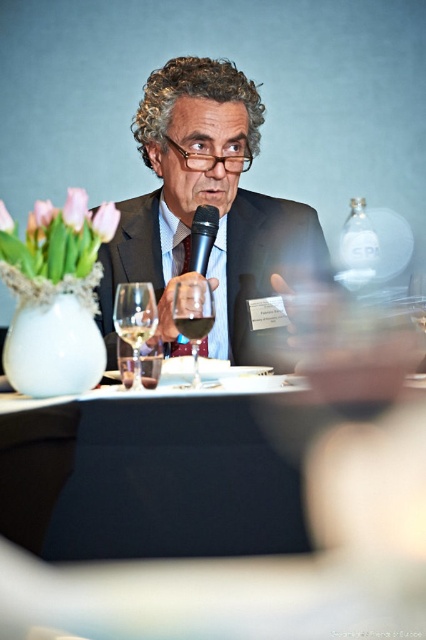
Question: Which object is positioned closest to the transparent glass wine glass at center?

Choices:
 (A) clear glass wine at center
 (B) translucent glass wine at center
 (C) black matte microphone at center
 (D) matte black suit at center

Answer: (B)

Question: Which object appears farthest from the camera in this image?

Choices:
 (A) translucent glass wine at center
 (B) black matte microphone at center

Answer: (B)

Question: Estimate the real-world distances between objects in this image. Which object is farther from the transparent glass wine glass at center?

Choices:
 (A) matte black suit at center
 (B) clear glass wine at center

Answer: (A)

Question: Can you confirm if clear glass wine glass at center is thinner than translucent glass wine at center?

Choices:
 (A) no
 (B) yes

Answer: (A)

Question: Does clear glass wine glass at center appear over clear glass wine at center?

Choices:
 (A) no
 (B) yes

Answer: (B)

Question: Is clear glass wine glass at center below transparent glass wine glass at center?

Choices:
 (A) yes
 (B) no

Answer: (A)